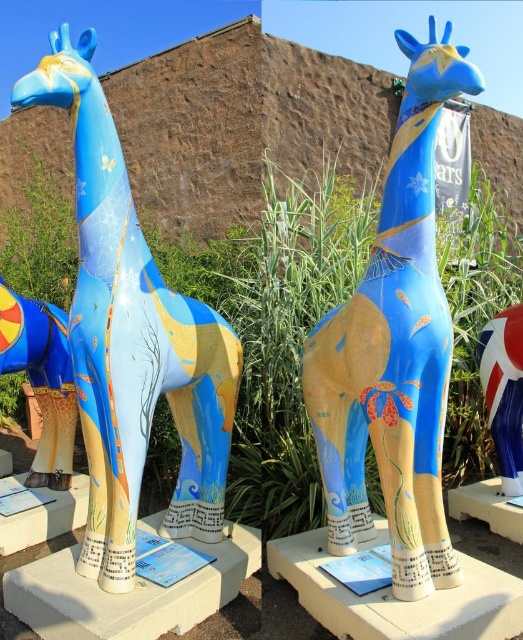
Question: Can you confirm if matte painted giraffe at center is thinner than matte yellow giraffe at left?

Choices:
 (A) no
 (B) yes

Answer: (A)

Question: Is matte painted giraffe at center smaller than matte yellow giraffe at left?

Choices:
 (A) no
 (B) yes

Answer: (A)

Question: Estimate the real-world distances between objects in this image. Which object is farther from the matte painted giraffe at center?

Choices:
 (A) matte blue giraffe at center
 (B) matte yellow giraffe at left

Answer: (B)

Question: Which point is farther from the camera taking this photo?

Choices:
 (A) (157, 275)
 (B) (4, 355)

Answer: (B)

Question: Does matte painted giraffe at center appear under matte yellow giraffe at left?

Choices:
 (A) yes
 (B) no

Answer: (B)

Question: Which point is closer to the camera taking this photo?

Choices:
 (A) (60, 442)
 (B) (191, 483)

Answer: (B)